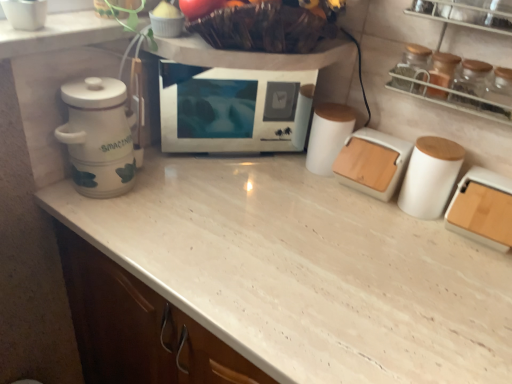
This screenshot has height=384, width=512. Describe the element at coordinates (372, 162) in the screenshot. I see `white matte bread bin at center-right, acting as the 1th kitchen appliance starting from the left` at that location.

The height and width of the screenshot is (384, 512). In order to click on white matte bread bin at center-right, marked as the third kitchen appliance in a right-to-left arrangement in this screenshot , I will do `click(372, 162)`.

In order to click on white matte container at center in this screenshot , I will do `click(328, 136)`.

What do you see at coordinates (430, 176) in the screenshot? I see `white matte container at right, the second kitchen appliance positioned from the left` at bounding box center [430, 176].

What do you see at coordinates (472, 77) in the screenshot? This screenshot has height=384, width=512. I see `transparent glass jar at upper right` at bounding box center [472, 77].

You are a GUI agent. You are given a task and a screenshot of the screen. Output one action in this format:
    pyautogui.click(x=<x>, y=<y>)
    Task: Click on the wooden lid container at right, which is the third kitchen appliance from left to right
    This screenshot has height=384, width=512.
    Given the screenshot: What is the action you would take?
    pyautogui.click(x=482, y=209)

From a real-world perspective, is transparent glass jar at upper right under white matte microwave oven at center?

No, from a real-world perspective, transparent glass jar at upper right is not below white matte microwave oven at center.

Is the position of transparent glass jar at upper right less distant than that of white matte microwave oven at center?

Yes, transparent glass jar at upper right is closer to the camera.

Considering the points (511, 85) and (284, 81), which point is behind, point (511, 85) or point (284, 81)?

The point (284, 81) is farther.

Is transparent glass jar at upper right located outside white matte microwave oven at center?

Yes.

From the image's perspective, is transparent glass jar at upper right on transparent glass jar at upper right?

Yes.

Consider the image. Is transparent glass jar at upper right wider than transparent glass jar at upper right?

Yes.

In the image, is transparent glass jar at upper right on the left side or the right side of transparent glass jar at upper right?

transparent glass jar at upper right is positioned on transparent glass jar at upper right's left side.

Identify the location of bottle that is on the right side of transparent glass jar at upper right. This screenshot has height=384, width=512. (500, 86).

Does transparent glass jar at upper right have a smaller size compared to white matte container at right, which ranks as the 2th kitchen appliance in right-to-left order?

Indeed, transparent glass jar at upper right has a smaller size compared to white matte container at right, which ranks as the 2th kitchen appliance in right-to-left order.

From a real-world perspective, between transparent glass jar at upper right and white matte container at right, which ranks as the 2th kitchen appliance in right-to-left order, who is vertically higher?

In real-world perspective, transparent glass jar at upper right is above.

Is transparent glass jar at upper right turned away from white matte container at right, the second kitchen appliance positioned from the left?

transparent glass jar at upper right does not have its back to white matte container at right, the second kitchen appliance positioned from the left.

Which point is more forward, [492,91] or [455,171]?

The point [492,91] is more forward.

Is white ceramic canister at left bigger or smaller than wooden lid container at right, which is the third kitchen appliance from left to right?

Clearly, white ceramic canister at left is larger in size than wooden lid container at right, which is the third kitchen appliance from left to right.

From the image's perspective, which is below, white ceramic canister at left or wooden lid container at right, placed as the first kitchen appliance when sorted from right to left?

wooden lid container at right, placed as the first kitchen appliance when sorted from right to left, from the image's perspective.

Between white ceramic canister at left and wooden lid container at right, placed as the first kitchen appliance when sorted from right to left, which one appears on the right side from the viewer's perspective?

wooden lid container at right, placed as the first kitchen appliance when sorted from right to left.

Looking at this image, is white ceramic canister at left not inside wooden lid container at right, which is the third kitchen appliance from left to right?

white ceramic canister at left is positioned outside wooden lid container at right, which is the third kitchen appliance from left to right.

Is white matte container at center at the left side of white matte microwave oven at center?

In fact, white matte container at center is to the right of white matte microwave oven at center.

Which point is more distant from viewer, (324, 141) or (225, 99)?

The point (324, 141) is farther.

From the image's perspective, which is below, white matte container at center or white matte microwave oven at center?

white matte container at center is shown below in the image.

The width and height of the screenshot is (512, 384). I want to click on microwave oven that appears above the white matte container at center (from the image's perspective), so click(233, 108).

The image size is (512, 384). Identify the location of home appliance lying in front of the white matte container at center. (98, 137).

Does white matte container at center lie in front of white ceramic canister at left?

No, white matte container at center is further to the viewer.

Considering the positions of objects white matte container at center and white ceramic canister at left in the image provided, who is more to the left, white matte container at center or white ceramic canister at left?

white ceramic canister at left is more to the left.

Considering the positions of objects wooden lid container at right, which is the third kitchen appliance from left to right, and transparent glass jar at upper right in the image provided, who is behind, wooden lid container at right, which is the third kitchen appliance from left to right, or transparent glass jar at upper right?

transparent glass jar at upper right is behind.

Does wooden lid container at right, placed as the first kitchen appliance when sorted from right to left, appear on the right side of transparent glass jar at upper right?

Yes.

Who is smaller, wooden lid container at right, which is the third kitchen appliance from left to right, or transparent glass jar at upper right?

transparent glass jar at upper right is smaller.

The image size is (512, 384). I want to click on bottle lying behind the wooden lid container at right, placed as the first kitchen appliance when sorted from right to left, so click(500, 86).

At what (x,y) coordinates should I click in order to perform the action: click on bottle above the white matte microwave oven at center (from a real-world perspective). Please return your answer as a coordinate pair (x, y). This screenshot has height=384, width=512. Looking at the image, I should click on (500, 86).

You are a GUI agent. You are given a task and a screenshot of the screen. Output one action in this format:
    pyautogui.click(x=<x>, y=<y>)
    Task: Click on the glass jar behind the transparent glass jar at upper right
    The width and height of the screenshot is (512, 384).
    Given the screenshot: What is the action you would take?
    pyautogui.click(x=472, y=77)

Considering their positions, is white matte microwave oven at center positioned closer to white matte bread bin at center-right, marked as the third kitchen appliance in a right-to-left arrangement, than transparent glass jar at upper right?

transparent glass jar at upper right lies closer to white matte bread bin at center-right, marked as the third kitchen appliance in a right-to-left arrangement, than the other object.

Estimate the real-world distances between objects in this image. Which object is further from transparent glass jar at upper right, white ceramic canister at left or wooden lid container at right, placed as the first kitchen appliance when sorted from right to left?

white ceramic canister at left.

From the image, which object appears to be nearer to transparent glass jars at upper right, white ceramic canister at left or white matte container at right, the second kitchen appliance positioned from the left?

Based on the image, white matte container at right, the second kitchen appliance positioned from the left, appears to be nearer to transparent glass jars at upper right.

Considering their positions, is white matte bread bin at center-right, marked as the third kitchen appliance in a right-to-left arrangement, positioned closer to white matte container at center than white ceramic canister at left?

white matte bread bin at center-right, marked as the third kitchen appliance in a right-to-left arrangement, is closer to white matte container at center.

Based on their spatial positions, is transparent glass jar at upper right or white matte bread bin at center-right, acting as the 1th kitchen appliance starting from the left, closer to wooden lid container at right, placed as the first kitchen appliance when sorted from right to left?

white matte bread bin at center-right, acting as the 1th kitchen appliance starting from the left.

Considering their positions, is white matte container at right, which ranks as the 2th kitchen appliance in right-to-left order, positioned closer to white matte container at center than white matte bread bin at center-right, marked as the third kitchen appliance in a right-to-left arrangement?

white matte bread bin at center-right, marked as the third kitchen appliance in a right-to-left arrangement, lies closer to white matte container at center than the other object.

Looking at the image, which one is located further to white ceramic canister at left, transparent glass jar at upper right or white matte container at right, the second kitchen appliance positioned from the left?

Among the two, transparent glass jar at upper right is located further to white ceramic canister at left.

From the image, which object appears to be nearer to white matte container at center, transparent glass jar at upper right or white matte microwave oven at center?

The object closer to white matte container at center is white matte microwave oven at center.

At what (x,y) coordinates should I click in order to perform the action: click on kitchen appliance between white matte bread bin at center-right, marked as the third kitchen appliance in a right-to-left arrangement, and wooden lid container at right, placed as the first kitchen appliance when sorted from right to left. Please return your answer as a coordinate pair (x, y). The height and width of the screenshot is (384, 512). Looking at the image, I should click on (430, 176).

At what (x,y) coordinates should I click in order to perform the action: click on glass jar situated between white ceramic canister at left and transparent glass jar at upper right from left to right. Please return your answer as a coordinate pair (x, y). This screenshot has width=512, height=384. Looking at the image, I should click on (472, 77).

Locate an element on the screen. This screenshot has width=512, height=384. appliance located between white ceramic canister at left and white matte container at right, the second kitchen appliance positioned from the left, in the left-right direction is located at coordinates (328, 136).

The width and height of the screenshot is (512, 384). I want to click on microwave oven located between white ceramic canister at left and white matte bread bin at center-right, marked as the third kitchen appliance in a right-to-left arrangement, in the left-right direction, so click(233, 108).